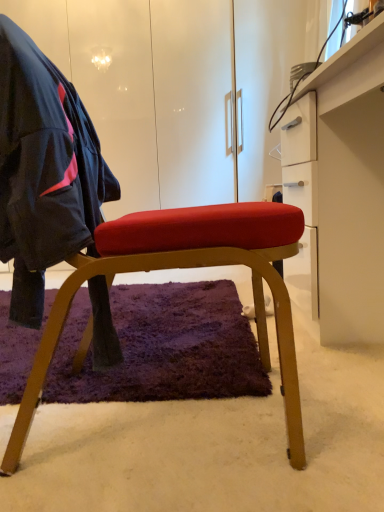
In the scene shown: What is the approximate width of white glossy desk at right?

17.20 inches.

Identify the location of matte black jacket at left. (44, 170).

Identify the location of white glossy desk at right. (339, 192).

From a real-world perspective, is matte wood chair at center physically located above or below white glossy desk at right?

matte wood chair at center is above white glossy desk at right.

From the image's perspective, which object appears higher, matte wood chair at center or white glossy desk at right?

white glossy desk at right, from the image's perspective.

Which object is positioned more to the left, matte wood chair at center or white glossy desk at right?

From the viewer's perspective, matte wood chair at center appears more on the left side.

Choose the correct answer: Is matte wood chair at center inside white glossy desk at right or outside it?

matte wood chair at center is located beyond the bounds of white glossy desk at right.

Considering the positions of point (0, 198) and point (344, 250), is point (0, 198) closer or farther from the camera than point (344, 250)?

Point (0, 198) is positioned closer to the camera compared to point (344, 250).

Consider the image. From a real-world perspective, who is located higher, matte black jacket at left or white glossy desk at right?

In real-world perspective, matte black jacket at left is above.

At what (x,y) coordinates should I click in order to perform the action: click on cloak below the white glossy desk at right (from the image's perspective). Please return your answer as a coordinate pair (x, y). This screenshot has height=512, width=384. Looking at the image, I should click on (44, 170).

Considering their positions, is matte black jacket at left located in front of or behind white glossy desk at right?

Visually, matte black jacket at left is located in front of white glossy desk at right.

Is point (327, 265) closer or farther from the camera than point (72, 252)?

Point (327, 265) is positioned farther from the camera compared to point (72, 252).

Does white glossy desk at right come behind matte black jacket at left?

That is True.

Consider the image. Measure the distance between white glossy desk at right and matte black jacket at left.

67.72 centimeters.

Find the location of a particular element. cloak that appears on the left of white glossy desk at right is located at coordinates (44, 170).

In the image, is matte wood chair at center positioned in front of or behind matte black jacket at left?

matte wood chair at center is behind matte black jacket at left.

From the picture: How many degrees apart are the facing directions of matte wood chair at center and matte black jacket at left?

They differ by 0.000877 degrees in their facing directions.

From a real-world perspective, who is located lower, matte wood chair at center or matte black jacket at left?

In real-world perspective, matte wood chair at center is lower.

Is matte wood chair at center positioned with its back to matte black jacket at left?

That's right, matte wood chair at center is facing away from matte black jacket at left.

Can you confirm if matte black jacket at left is positioned to the left of matte wood chair at center?

Yes.

Is matte black jacket at left aimed at matte wood chair at center?

Yes, matte black jacket at left faces towards matte wood chair at center.

From a real-world perspective, is matte black jacket at left on top of matte wood chair at center?

Yes, from a real-world perspective, matte black jacket at left is on top of matte wood chair at center.

Would you say matte black jacket at left is outside matte wood chair at center?

That's incorrect, matte black jacket at left is not completely outside matte wood chair at center.

Choose the correct answer: Is white glossy desk at right inside matte wood chair at center or outside it?

white glossy desk at right is outside matte wood chair at center.

How far apart are white glossy desk at right and matte wood chair at center?

white glossy desk at right is 23.71 inches from matte wood chair at center.

From the image's perspective, would you say white glossy desk at right is shown under matte wood chair at center?

No, from the image's perspective, white glossy desk at right is not beneath matte wood chair at center.

I want to click on chair located above the white glossy desk at right (from a real-world perspective), so click(124, 247).

The height and width of the screenshot is (512, 384). I want to click on chair in front of the white glossy desk at right, so click(x=124, y=247).

What are the coordinates of `desk below the matte black jacket at left (from a real-world perspective)` in the screenshot? It's located at (339, 192).

Which object lies further to the anchor point matte wood chair at center, matte black jacket at left or white glossy desk at right?

The object further to matte wood chair at center is white glossy desk at right.

Estimate the real-world distances between objects in this image. Which object is further from white glossy desk at right, matte black jacket at left or matte wood chair at center?

matte black jacket at left is positioned further to the anchor white glossy desk at right.

Which object lies further to the anchor point matte black jacket at left, matte wood chair at center or white glossy desk at right?

white glossy desk at right lies further to matte black jacket at left than the other object.

From the image, which object appears to be farther from matte black jacket at left, white glossy desk at right or matte wood chair at center?

white glossy desk at right is further to matte black jacket at left.

Looking at the image, which one is located further to matte wood chair at center, white glossy desk at right or matte black jacket at left?

white glossy desk at right lies further to matte wood chair at center than the other object.

Looking at the image, which one is located closer to white glossy desk at right, matte wood chair at center or matte black jacket at left?

Among the two, matte wood chair at center is located nearer to white glossy desk at right.

Image resolution: width=384 pixels, height=512 pixels. In order to click on chair situated between matte black jacket at left and white glossy desk at right from left to right in this screenshot , I will do `click(124, 247)`.